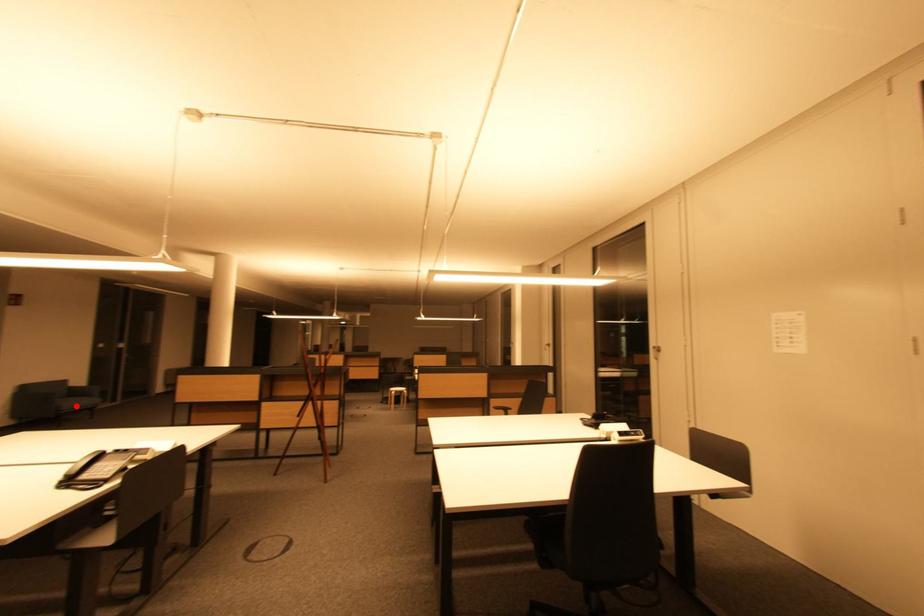
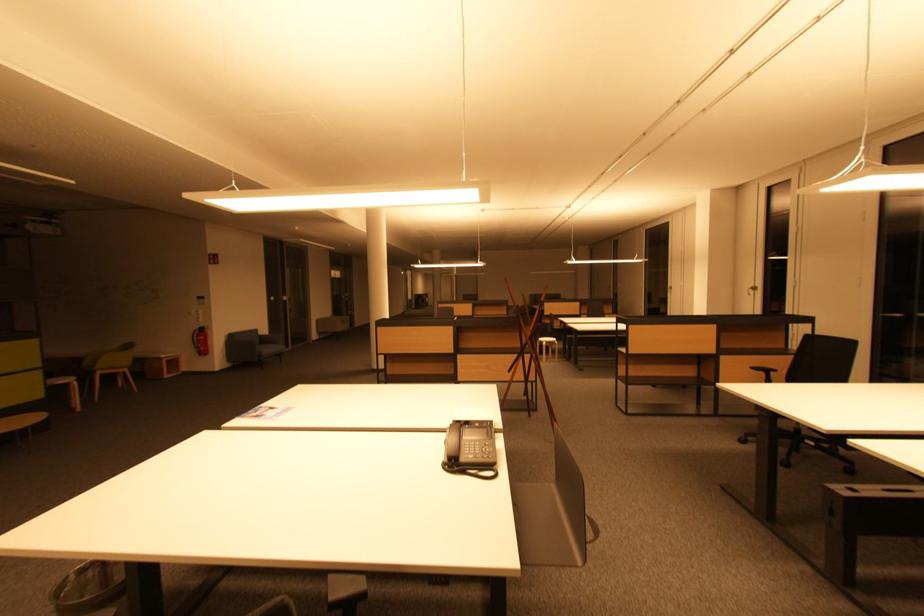
Locate, in the second image, the point that corresponds to the highlighted location in the first image.

(272, 352)